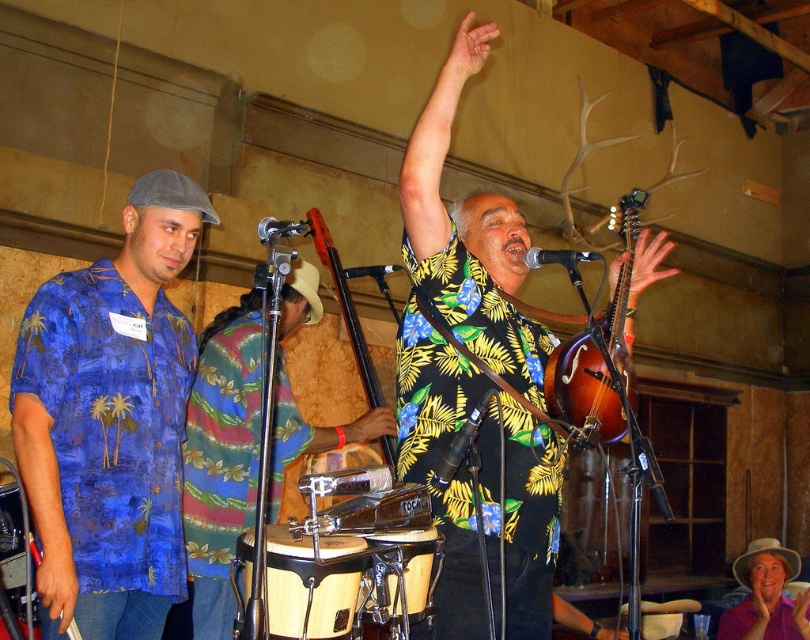
In the scene shown: Is multicolored fabric shirt at center shorter than wooden bongo drum at center?

In fact, multicolored fabric shirt at center may be taller than wooden bongo drum at center.

Which of these two, multicolored fabric shirt at center or wooden bongo drum at center, stands shorter?

wooden bongo drum at center is shorter.

You are a GUI agent. You are given a task and a screenshot of the screen. Output one action in this format:
    pyautogui.click(x=<x>, y=<y>)
    Task: Click on the multicolored fabric shirt at center
    The height and width of the screenshot is (640, 810).
    Given the screenshot: What is the action you would take?
    pyautogui.click(x=220, y=458)

Between blue floral shirt at left and brown wooden mandolin at center, which one has more height?

blue floral shirt at left

Is blue floral shirt at left positioned before brown wooden mandolin at center?

No, it is not.

This screenshot has height=640, width=810. Find the location of `blue floral shirt at left`. blue floral shirt at left is located at coordinates (109, 420).

You are a GUI agent. You are given a task and a screenshot of the screen. Output one action in this format:
    pyautogui.click(x=<x>, y=<y>)
    Task: Click on the blue floral shirt at left
    This screenshot has height=640, width=810.
    Given the screenshot: What is the action you would take?
    pyautogui.click(x=109, y=420)

Does blue floral shirt at left have a lesser height compared to wooden bongo drum at center?

No, blue floral shirt at left is not shorter than wooden bongo drum at center.

Is blue floral shirt at left below wooden bongo drum at center?

No, blue floral shirt at left is not below wooden bongo drum at center.

Image resolution: width=810 pixels, height=640 pixels. Identify the location of blue floral shirt at left. (109, 420).

Identify the location of blue floral shirt at left. The height and width of the screenshot is (640, 810). (109, 420).